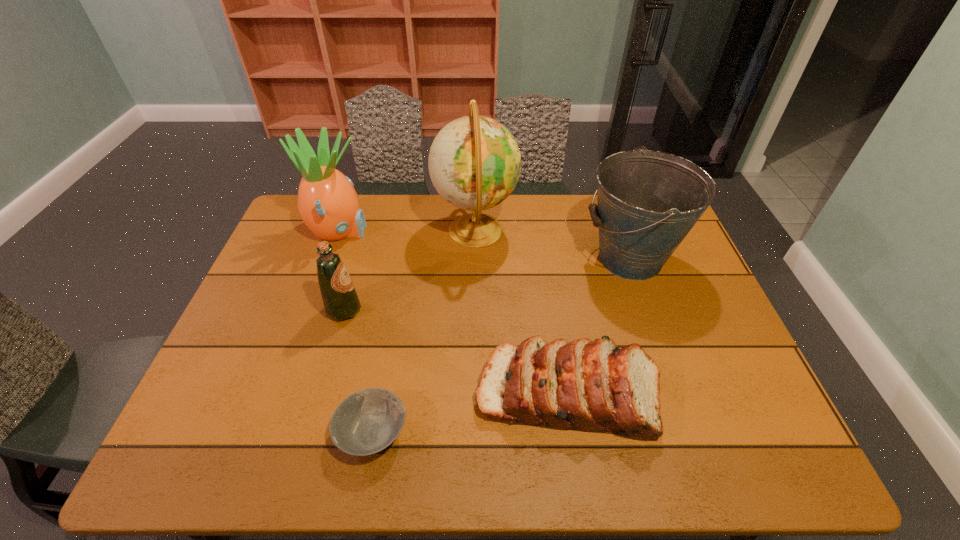
You are a GUI agent. You are given a task and a screenshot of the screen. Output one action in this format:
    pyautogui.click(x=<x>, y=<y>)
    Task: Click on the vacant space in between the third nearest object and the bowl
    This screenshot has height=540, width=960.
    Given the screenshot: What is the action you would take?
    pyautogui.click(x=358, y=370)

Find the location of `free space that is in between the second shortest object and the bucket`. free space that is in between the second shortest object and the bucket is located at coordinates (599, 326).

I want to click on empty location between the fourth farthest object and the third object from left to right, so click(x=358, y=370).

Locate an element on the screen. vacant area that lies between the globe and the pineapple is located at coordinates (407, 231).

Locate an element on the screen. Image resolution: width=960 pixels, height=540 pixels. vacant space that's between the tallest object and the pineapple is located at coordinates (407, 231).

Locate an element on the screen. This screenshot has height=540, width=960. blank region between the fifth tallest object and the tallest object is located at coordinates (522, 312).

Identify the location of vacant area between the bucket and the tallest object. The width and height of the screenshot is (960, 540). pos(553,244).

You are a GUI agent. You are given a task and a screenshot of the screen. Output one action in this format:
    pyautogui.click(x=<x>, y=<y>)
    Task: Click on the object that is the fourth closest to the olive oil
    This screenshot has height=540, width=960.
    Given the screenshot: What is the action you would take?
    pyautogui.click(x=594, y=386)

Select which object is the closest to the shortest object. Please provide its 2D coordinates. Your answer should be formatted as a tuple, i.e. [(x, y)], where the tuple contains the x and y coordinates of a point satisfying the conditions above.

[(594, 386)]

Identify the location of free location that satisfies the following two spatial constraints: 1. at the entrance of the fifth tallest object; 2. on the left side of the pineapple. This screenshot has width=960, height=540. (281, 393).